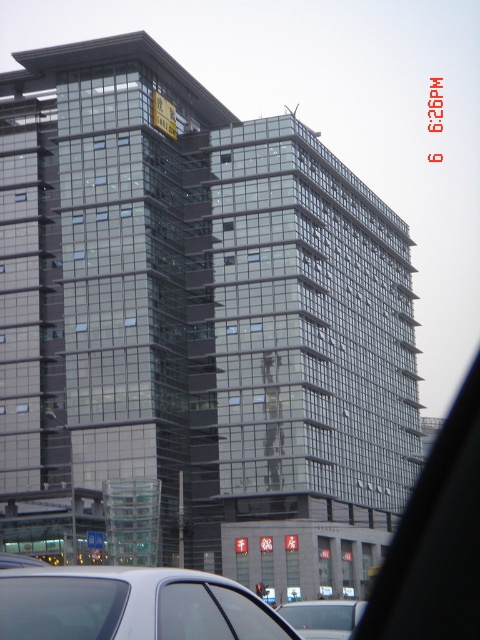
You are standing in front of the modern multi story building with contemporary architectural design. You see a point marked at coordinate (131, 605). What object is located at that point?

The point at coordinate (131, 605) indicates a silver metallic car at lower left.

You are a delivery person driving a white matte car at lower center and need to park it in a parking spot that requires the vehicle to be no taller than the transparent glass car window at lower left. Will your car fit in the parking spot based on their heights?

The transparent glass car window at lower left is shorter than the white matte car at lower center, so the white matte car at lower center is taller. Therefore, the white matte car at lower center will not fit in the parking spot that requires vehicles to be no taller than the transparent glass car window at lower left.